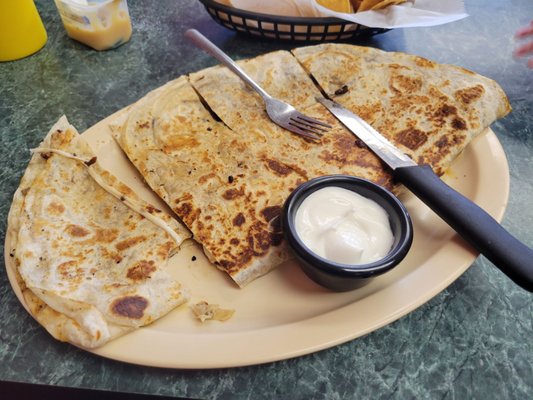
This screenshot has width=533, height=400. In order to click on plate in this screenshot , I will do `click(271, 322)`.